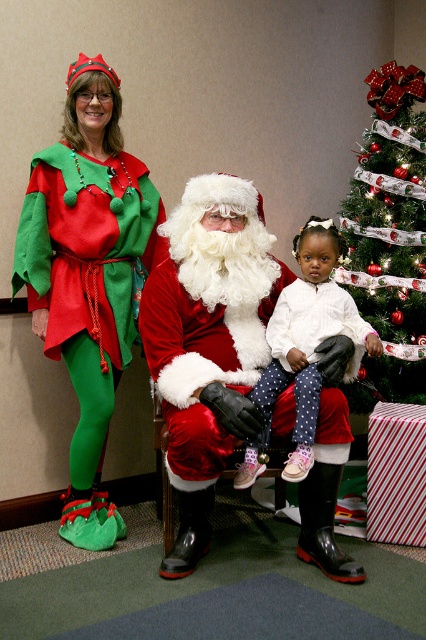
Question: Does matte green fabric elf costume at left have a greater width compared to white polka dot pants at center?

Choices:
 (A) no
 (B) yes

Answer: (B)

Question: Which object is closer to the camera taking this photo?

Choices:
 (A) white polka dot pants at center
 (B) green textured fabric christmas tree at right
 (C) matte green fabric elf costume at left
 (D) satin/velvet santa at center

Answer: (D)

Question: Among these objects, which one is farthest from the camera?

Choices:
 (A) white polka dot pants at center
 (B) green textured fabric christmas tree at right
 (C) matte green fabric elf costume at left

Answer: (B)

Question: Which point is farther from the camera taking this photo?

Choices:
 (A) (247, 465)
 (B) (383, 337)

Answer: (B)

Question: Can you confirm if satin/velvet santa at center is positioned below green textured fabric christmas tree at right?

Choices:
 (A) yes
 (B) no

Answer: (A)

Question: Observing the image, what is the correct spatial positioning of satin/velvet santa at center in reference to matte green fabric elf costume at left?

Choices:
 (A) below
 (B) above

Answer: (A)